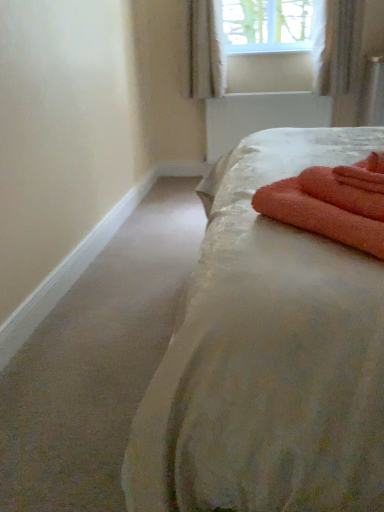
Question: Considering the relative sizes of white textured curtain at upper right, which is the 1th curtain in right-to-left order, and white sheer curtain at upper center, acting as the 2th curtain starting from the right, in the image provided, is white textured curtain at upper right, which is the 1th curtain in right-to-left order, thinner than white sheer curtain at upper center, acting as the 2th curtain starting from the right,?

Choices:
 (A) yes
 (B) no

Answer: (A)

Question: Would you say white textured curtain at upper right, which appears as the second curtain when viewed from the left, contains white sheer curtain at upper center, acting as the 2th curtain starting from the right?

Choices:
 (A) no
 (B) yes

Answer: (A)

Question: From the image's perspective, is white textured curtain at upper right, which is the 1th curtain in right-to-left order, over white sheer curtain at upper center, the first curtain positioned from the left?

Choices:
 (A) no
 (B) yes

Answer: (A)

Question: From the image's perspective, is white textured curtain at upper right, which is the 1th curtain in right-to-left order, below white sheer curtain at upper center, acting as the 2th curtain starting from the right?

Choices:
 (A) yes
 (B) no

Answer: (A)

Question: Does white textured curtain at upper right, which is the 1th curtain in right-to-left order, have a smaller size compared to white sheer curtain at upper center, acting as the 2th curtain starting from the right?

Choices:
 (A) yes
 (B) no

Answer: (A)

Question: Considering the positions of point (340, 321) and point (377, 224), is point (340, 321) closer or farther from the camera than point (377, 224)?

Choices:
 (A) farther
 (B) closer

Answer: (B)

Question: In terms of size, does silky white bed at center appear bigger or smaller than orange terry cloth bath towel at right?

Choices:
 (A) small
 (B) big

Answer: (B)

Question: From a real-world perspective, is silky white bed at center above or below orange terry cloth bath towel at right?

Choices:
 (A) below
 (B) above

Answer: (A)

Question: From the image's perspective, is silky white bed at center positioned above or below orange terry cloth bath towel at right?

Choices:
 (A) below
 (B) above

Answer: (B)

Question: Considering the positions of silky white bed at center and white sheer curtain at upper center, acting as the 2th curtain starting from the right, in the image, is silky white bed at center wider or thinner than white sheer curtain at upper center, acting as the 2th curtain starting from the right,?

Choices:
 (A) wide
 (B) thin

Answer: (A)

Question: From their relative heights in the image, would you say silky white bed at center is taller or shorter than white sheer curtain at upper center, acting as the 2th curtain starting from the right?

Choices:
 (A) tall
 (B) short

Answer: (A)

Question: Considering the relative positions of silky white bed at center and white sheer curtain at upper center, the first curtain positioned from the left, in the image provided, is silky white bed at center to the left or to the right of white sheer curtain at upper center, the first curtain positioned from the left,?

Choices:
 (A) right
 (B) left

Answer: (A)

Question: From the image's perspective, is silky white bed at center located above or below white sheer curtain at upper center, the first curtain positioned from the left?

Choices:
 (A) above
 (B) below

Answer: (B)

Question: Considering the positions of white textured curtain at upper right, which appears as the second curtain when viewed from the left, and orange terry cloth bath towel at right in the image, is white textured curtain at upper right, which appears as the second curtain when viewed from the left, bigger or smaller than orange terry cloth bath towel at right?

Choices:
 (A) small
 (B) big

Answer: (B)

Question: Is point (349, 92) closer or farther from the camera than point (367, 159)?

Choices:
 (A) closer
 (B) farther

Answer: (B)